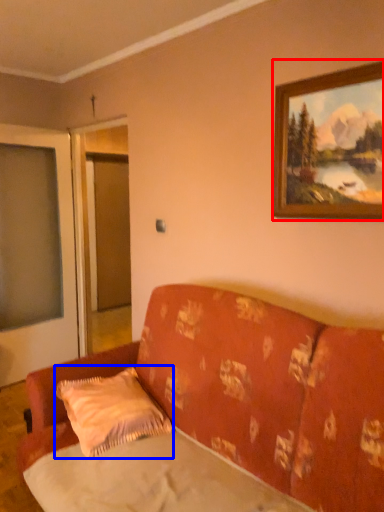
Question: Among these objects, which one is farthest to the camera, picture frame (highlighted by a red box) or pillow (highlighted by a blue box)?

Choices:
 (A) picture frame
 (B) pillow

Answer: (B)